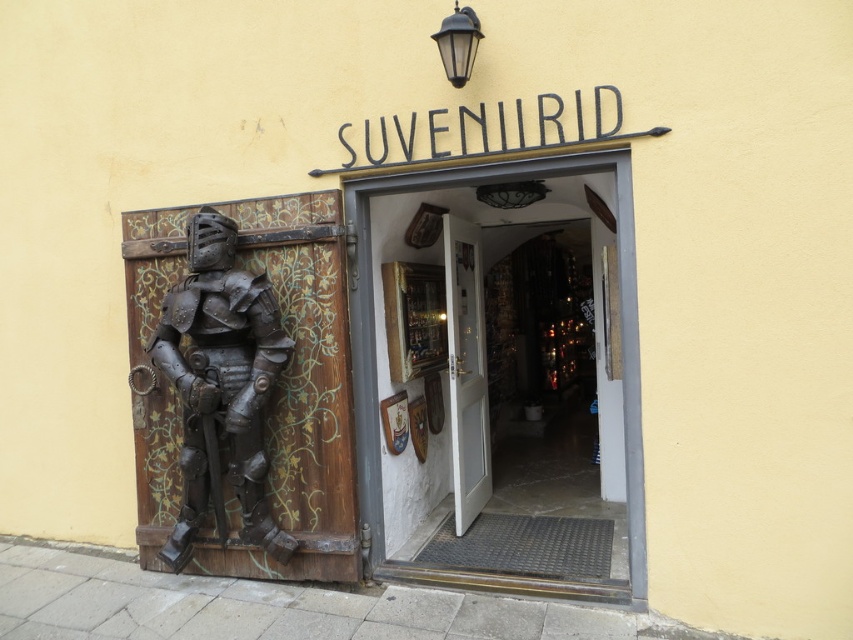
Does bronze armor at left come in front of wooden door at center?

No, it is behind wooden door at center.

Is bronze armor at left thinner than wooden door at center?

Correct, bronze armor at left's width is less than wooden door at center's.

Which is behind, point (207, 243) or point (627, 440)?

Point (207, 243)

Find the location of a particular element. The image size is (853, 640). bronze armor at left is located at coordinates (221, 387).

Between point (631, 262) and point (479, 264), which one is positioned in front?

Point (631, 262) is in front.

Which is above, wooden door at center or white wooden door at center?

wooden door at center is above.

The width and height of the screenshot is (853, 640). What do you see at coordinates (374, 333) in the screenshot? I see `wooden door at center` at bounding box center [374, 333].

The width and height of the screenshot is (853, 640). Find the location of `wooden door at center`. wooden door at center is located at coordinates (374, 333).

Is point (265, 538) behind point (471, 435)?

No, (265, 538) is closer to viewer.

Which is in front, point (210, 378) or point (444, 241)?

Point (210, 378)

Is point (218, 328) closer to camera compared to point (486, 435)?

Yes, point (218, 328) is in front of point (486, 435).

Locate an element on the screen. The height and width of the screenshot is (640, 853). bronze armor at left is located at coordinates (221, 387).